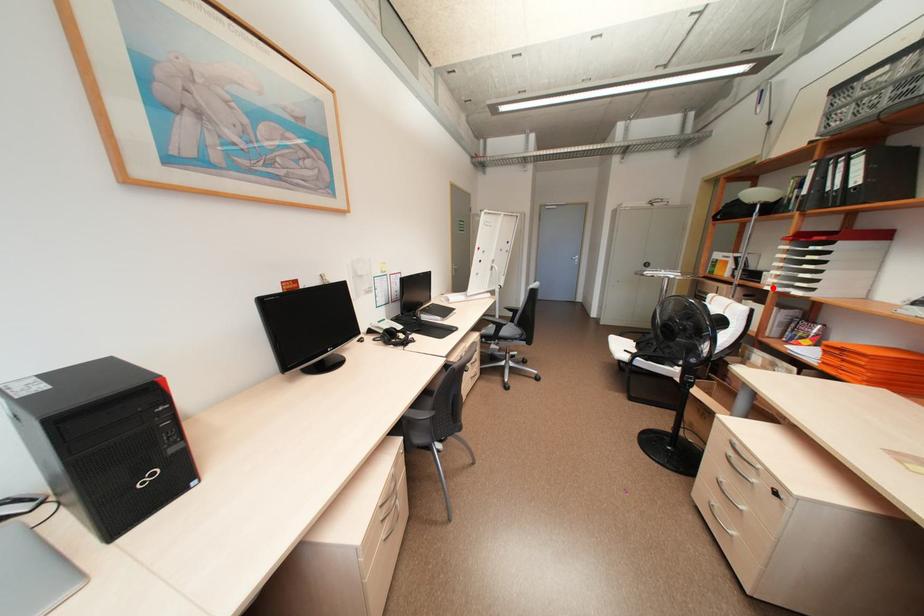
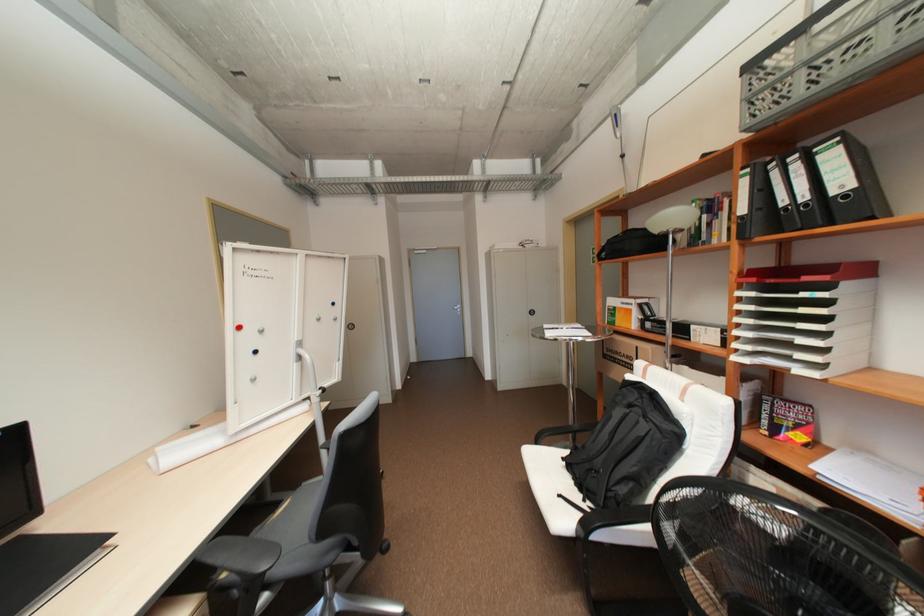
In the second image, find the point that corresponds to the highlighted location in the first image.

(742, 358)